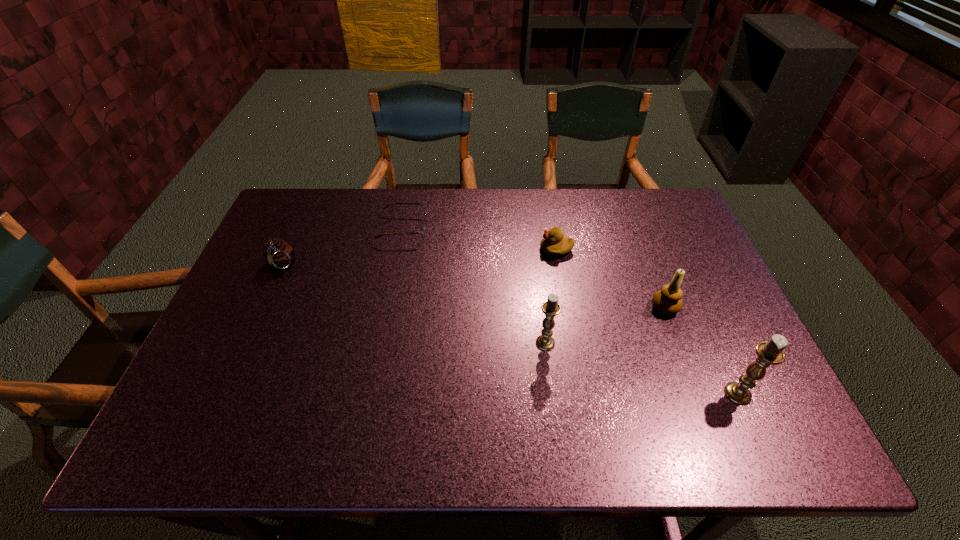
Identify the location of the leftmost candle_holder. The height and width of the screenshot is (540, 960). (551, 308).

The image size is (960, 540). What are the coordinates of `the second farthest candle_holder` in the screenshot? It's located at (551, 308).

The image size is (960, 540). I want to click on the tallest candle_holder, so click(770, 352).

Locate an element on the screen. The image size is (960, 540). the rightmost candle_holder is located at coordinates (770, 352).

This screenshot has height=540, width=960. In order to click on the leftmost object in this screenshot , I will do `click(279, 255)`.

Where is `pinecone`? The height and width of the screenshot is (540, 960). pinecone is located at coordinates (279, 255).

Identify the location of spectacles. This screenshot has height=540, width=960. (423, 228).

Where is `the shortest object`? Image resolution: width=960 pixels, height=540 pixels. the shortest object is located at coordinates (423, 228).

The height and width of the screenshot is (540, 960). Identify the location of the farthest candle_holder. (668, 301).

I want to click on the third tallest object, so click(668, 301).